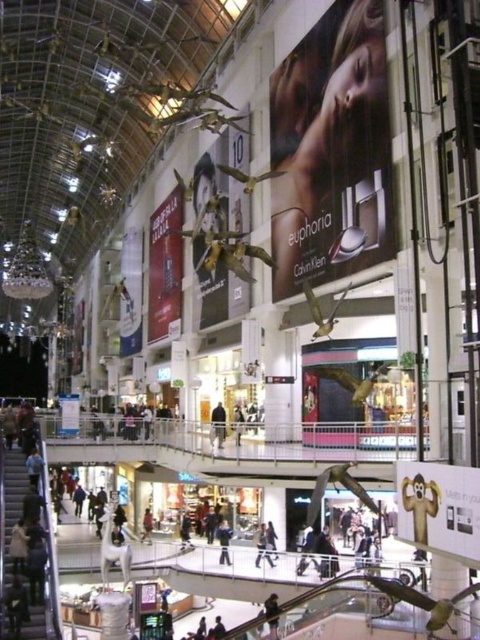
You are a customer standing in the mall and want to look at both the smooth skin billboard at upper center and the blue denim jeans at lower center. Which one is higher up?

The smooth skin billboard at upper center is above the blue denim jeans at lower center, so it is higher up.

You are standing in the mall and want to reach the point marked as point [272,625]. If you can walk at a speed of 1.5 meters per second, how many seconds will it take you to reach that point?

The distance between you and point [272,625] is 52.98 meters. At a walking speed of 1.5 meters per second, it would take approximately 35.32 seconds to reach the point.